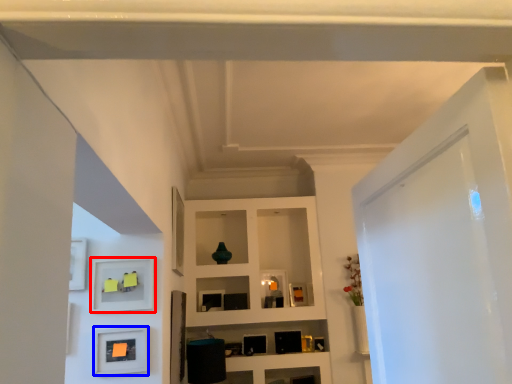
Question: Which object appears closest to the camera in this image, shelf (highlighted by a red box) or picture frame (highlighted by a blue box)?

Choices:
 (A) shelf
 (B) picture frame

Answer: (B)